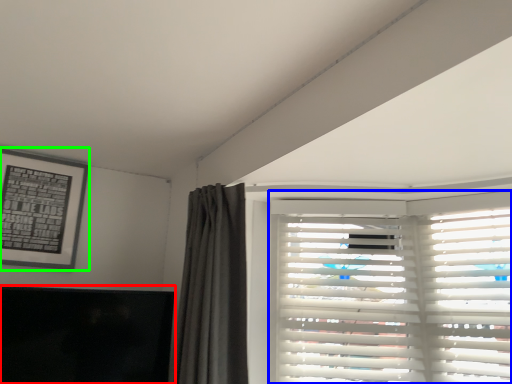
Question: Estimate the real-world distances between objects in this image. Which object is farther from window screen (highlighted by a red box), window blind (highlighted by a blue box) or picture frame (highlighted by a green box)?

Choices:
 (A) window blind
 (B) picture frame

Answer: (A)